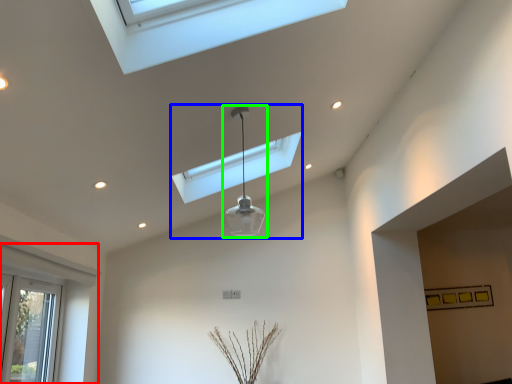
Question: Based on their relative distances, which object is farther from window (highlighted by a red box)? Choose from lamp (highlighted by a blue box) and lamp (highlighted by a green box).

Choices:
 (A) lamp
 (B) lamp

Answer: (B)